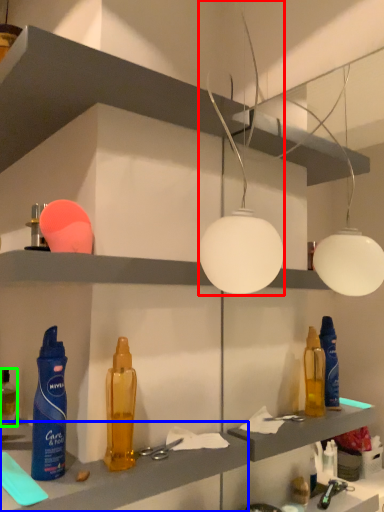
Question: Which object is the closest to the lamp (highlighted by a red box)? Choose among these: cabinet (highlighted by a blue box) or bottle (highlighted by a green box).

Choices:
 (A) cabinet
 (B) bottle

Answer: (A)